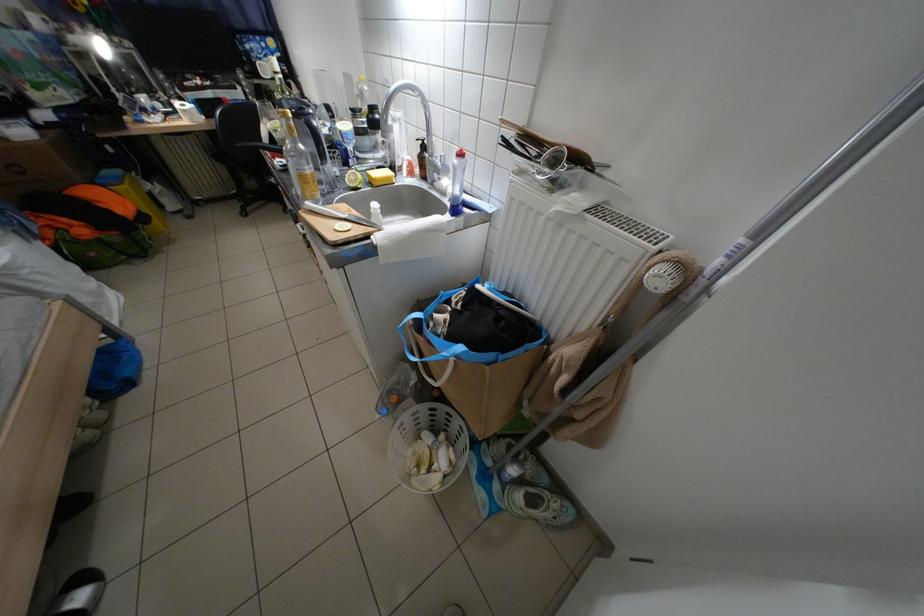
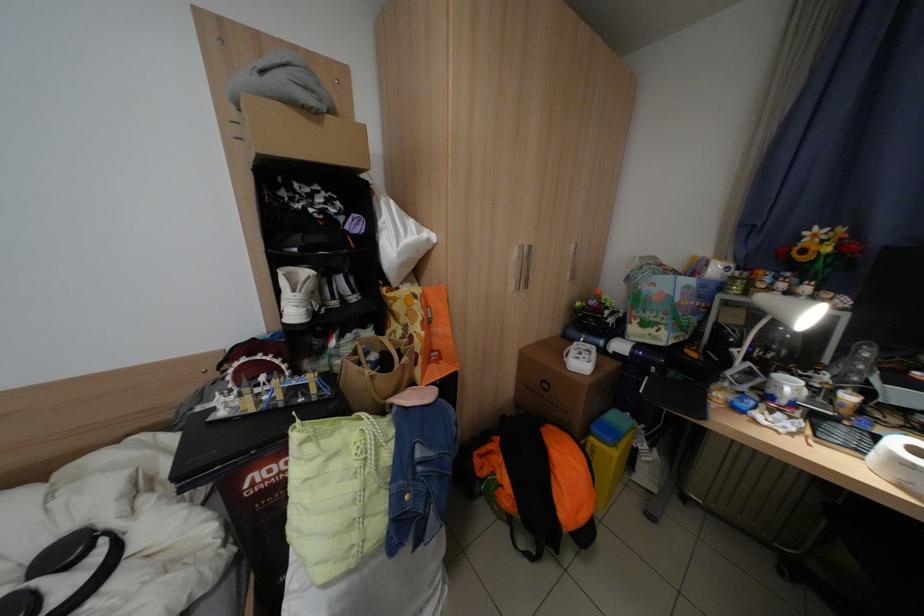
Locate, in the second image, the point that corresponds to (155,100) in the first image.

(800, 387)